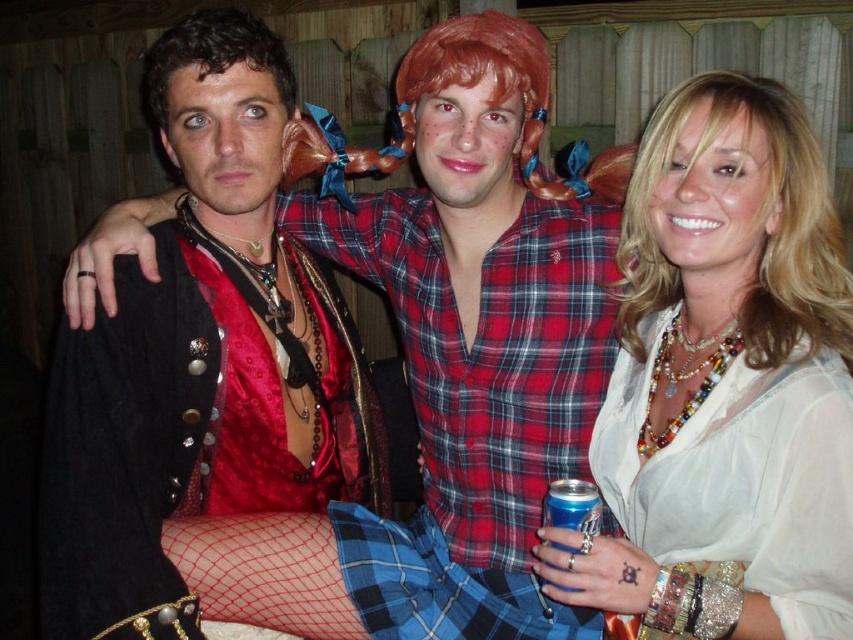
Is blonde synthetic wig at upper right shorter than blue metallic can at lower center?

In fact, blonde synthetic wig at upper right may be taller than blue metallic can at lower center.

Does point (788, 115) come farther from viewer compared to point (592, 500)?

No, it is in front of (592, 500).

Is point (810, 145) positioned in front of point (584, 545)?

That is False.

This screenshot has width=853, height=640. I want to click on blonde synthetic wig at upper right, so click(x=759, y=214).

Between curly brown hair at center and blue metallic can at lower center, which one is positioned lower?

blue metallic can at lower center is lower down.

From the picture: Which is more to the left, curly brown hair at center or blue metallic can at lower center?

curly brown hair at center is more to the left.

Locate an element on the screen. The image size is (853, 640). curly brown hair at center is located at coordinates (213, 54).

Between point (329, 344) and point (648, 193), which one is positioned behind?

The point (329, 344) is behind.

Does shiny satin vest at left appear under blonde synthetic wig at upper right?

Correct, shiny satin vest at left is located below blonde synthetic wig at upper right.

The width and height of the screenshot is (853, 640). Find the location of `shiny satin vest at left`. shiny satin vest at left is located at coordinates (201, 358).

Where is `shiny satin vest at left`? The height and width of the screenshot is (640, 853). shiny satin vest at left is located at coordinates (201, 358).